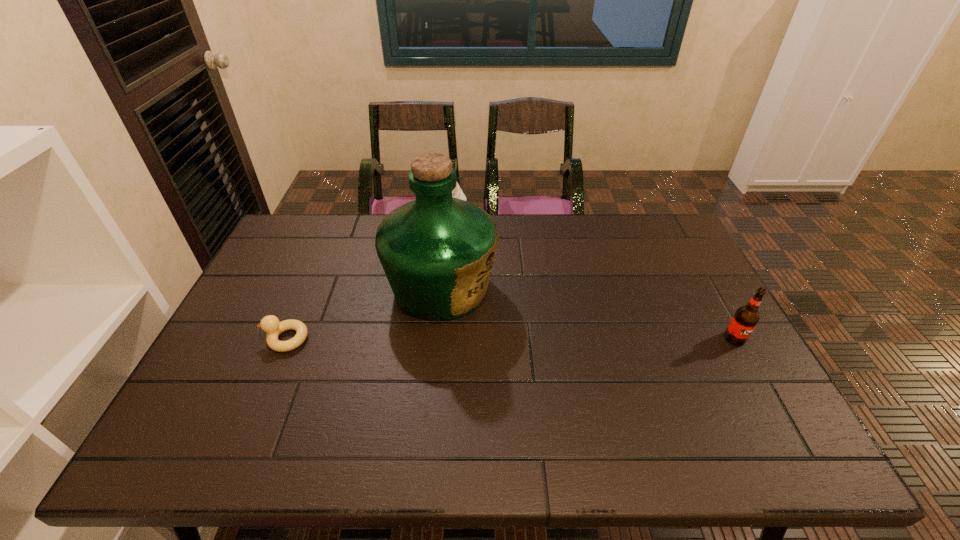
Where is `free space at the right edge of the desktop`? The width and height of the screenshot is (960, 540). free space at the right edge of the desktop is located at coordinates (707, 345).

In the image, there is a desktop. At what (x,y) coordinates should I click in order to perform the action: click on vacant region at the near left corner. Please return your answer as a coordinate pair (x, y). The image size is (960, 540). Looking at the image, I should click on (250, 409).

Where is `vacant space at the far right corner`? The height and width of the screenshot is (540, 960). vacant space at the far right corner is located at coordinates (628, 222).

Image resolution: width=960 pixels, height=540 pixels. I want to click on free space between the leftmost object and the icecream, so click(x=372, y=279).

Where is `vacant space that is in between the farthest object and the duckling`? The height and width of the screenshot is (540, 960). vacant space that is in between the farthest object and the duckling is located at coordinates click(x=372, y=279).

Where is `free space between the duckling and the liquor`? free space between the duckling and the liquor is located at coordinates (364, 313).

At what (x,y) coordinates should I click in order to perform the action: click on empty space between the shortest object and the rightmost object. Please return your answer as a coordinate pair (x, y). Image resolution: width=960 pixels, height=540 pixels. Looking at the image, I should click on click(511, 339).

Locate an element on the screen. The width and height of the screenshot is (960, 540). free space between the liquor and the shortest object is located at coordinates (364, 313).

In order to click on empty space that is in between the farthest object and the rightmost object in this screenshot , I will do `click(596, 279)`.

Identify the location of free point between the leftmost object and the root beer. The image size is (960, 540). (x=511, y=339).